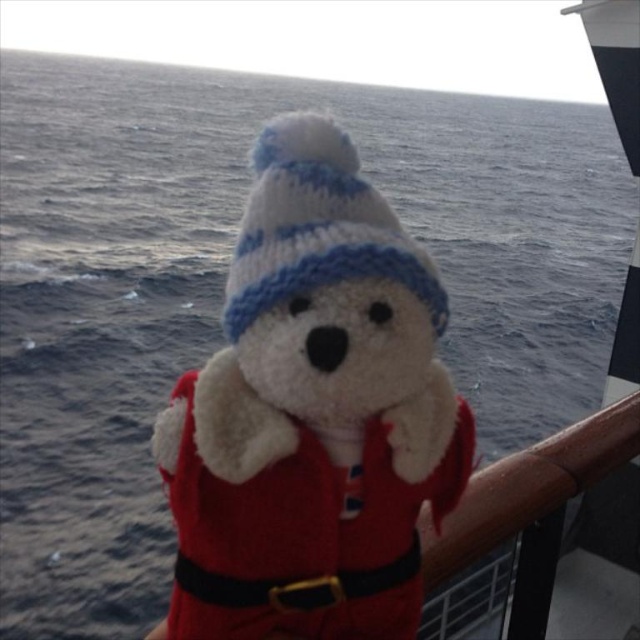
You are standing on a ship looking at the ocean and see a point at coordinate (314, 413). What object is located at that point?

The point at coordinate (314, 413) corresponds to the white plush Santa Claus at center.

You are a photographer trying to capture the white plush santa claus at center and the white knitted hat at center in a single frame. Based on their sizes, which object would appear larger in the photo?

The white plush santa claus at center would appear larger in the photo because it is much taller than the white knitted hat at center.

You are a photographer trying to capture the white plush santa claus at center and the white knitted hat at center in a clear photo. Which object will appear closer to the camera in the photo?

The white plush santa claus at center will appear closer to the camera because it is in front of the white knitted hat at center.